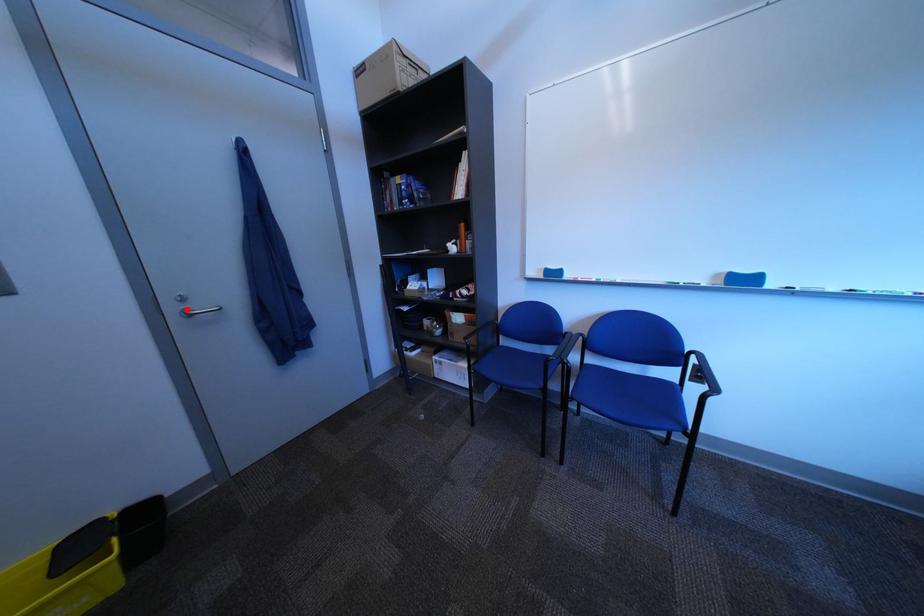
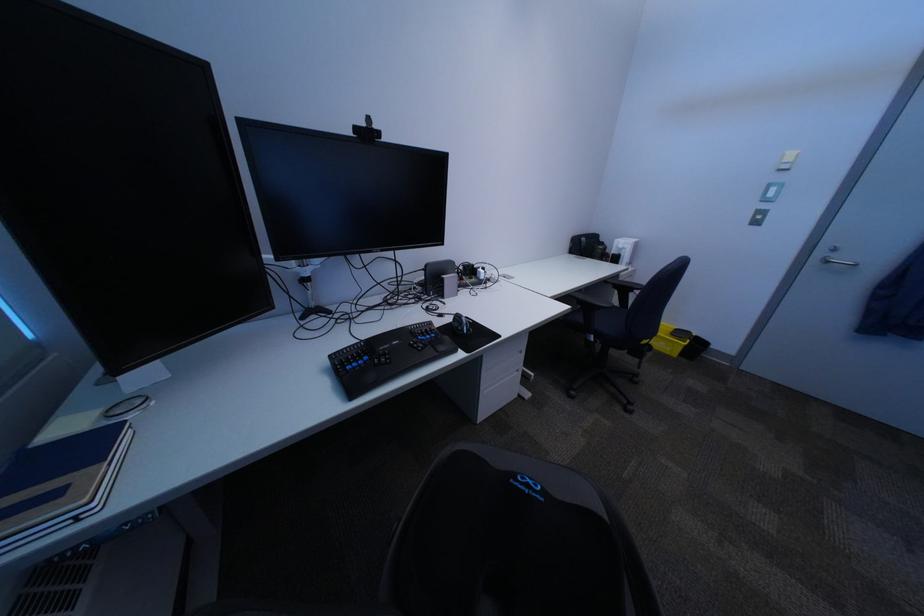
Locate, in the second image, the point that corresponds to the highlighted location in the first image.

(834, 254)